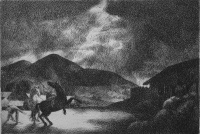
Identify the location of paint. Image resolution: width=200 pixels, height=134 pixels. (160, 45).